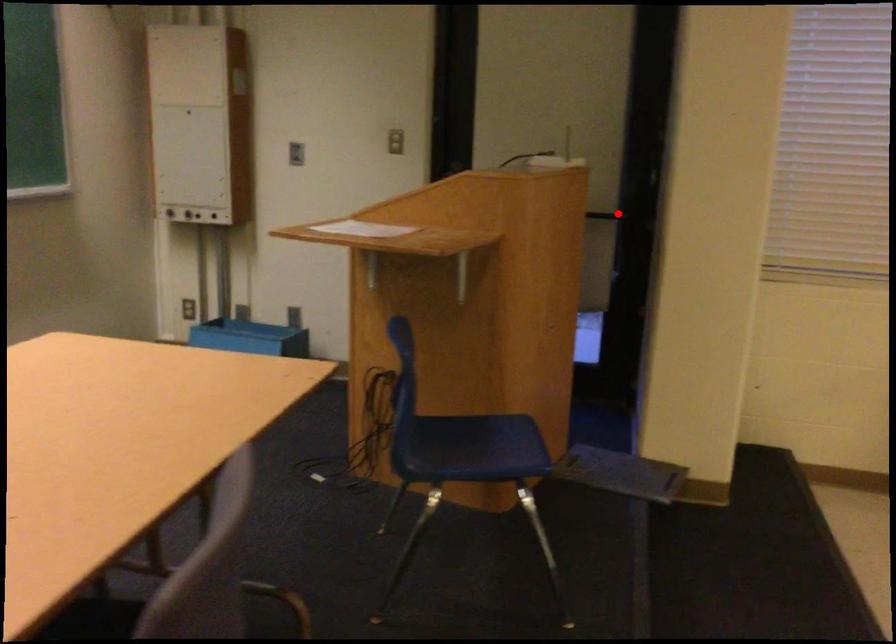
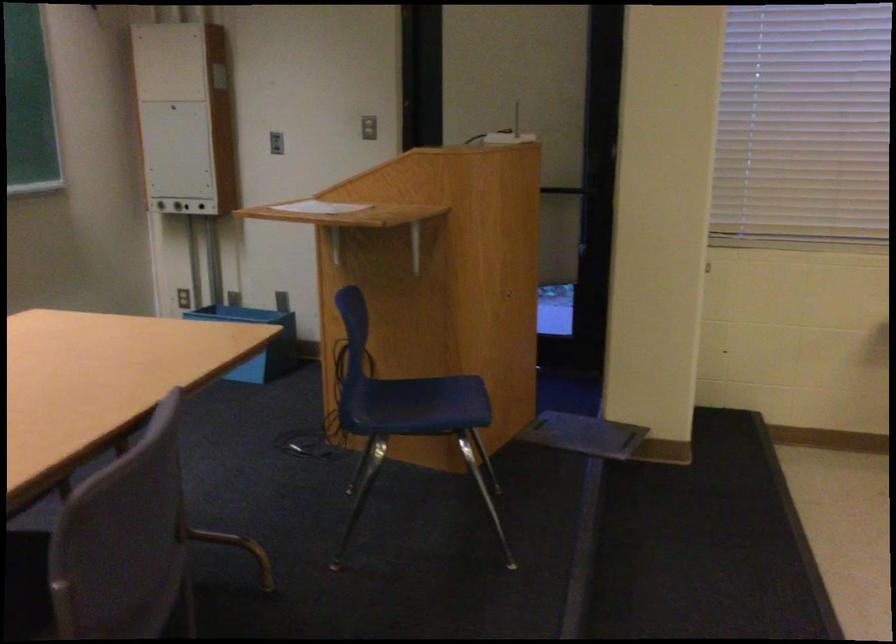
Where in the second image is the point corresponding to the highlighted location from the first image?

(583, 189)